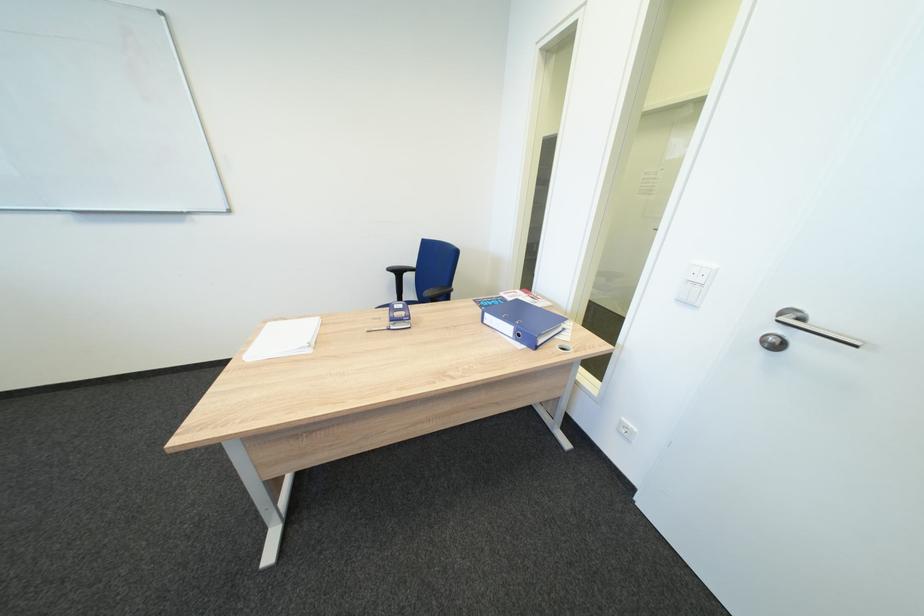
You are a GUI agent. You are given a task and a screenshot of the screen. Output one action in this format:
    pyautogui.click(x=<x>, y=<y>)
    Task: Click on the phone handset
    The height and width of the screenshot is (616, 924).
    Given the screenshot: What is the action you would take?
    pyautogui.click(x=398, y=315)